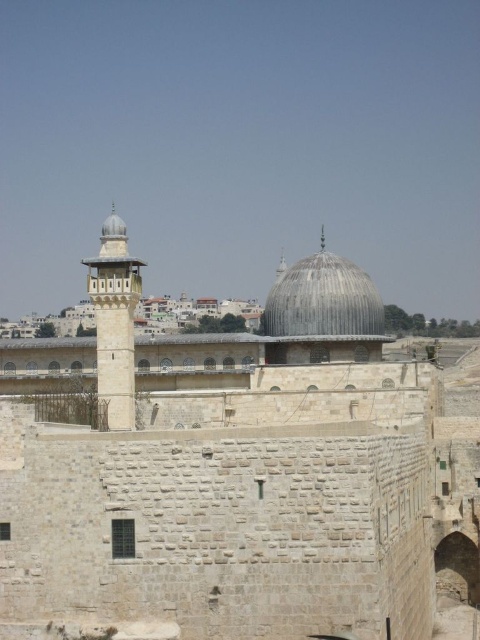
You are standing at the camera position and want to reach point [428,522]. Is the distance more than 80 meters?

The distance between point [428,522] and the camera is 87.53 meters, which is more than 80 meters.